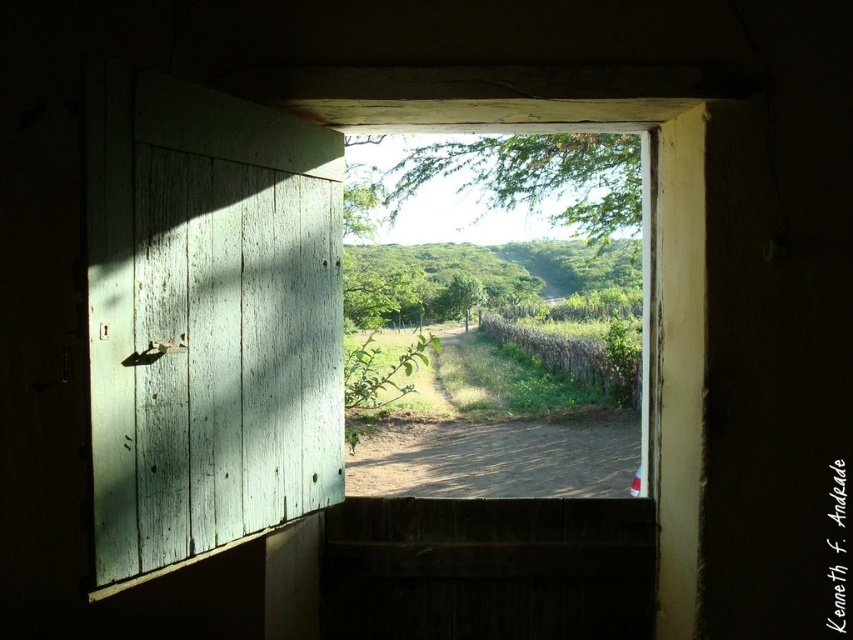
Is green wooden fence at center thinner than green leafy tree at center?

Correct, green wooden fence at center's width is less than green leafy tree at center's.

Measure the distance from green wooden fence at center to green leafy tree at center.

green wooden fence at center and green leafy tree at center are 2.82 meters apart.

What are the coordinates of `green wooden fence at center` in the screenshot? It's located at (537, 182).

Who is more distant from viewer, (x=195, y=515) or (x=418, y=312)?

The point (x=418, y=312) is behind.

Does green painted wood door at left have a greater height compared to green leafy tree at center?

Indeed, green painted wood door at left has a greater height compared to green leafy tree at center.

Locate an element on the screen. The image size is (853, 640). green painted wood door at left is located at coordinates (207, 320).

In the scene shown: Who is positioned more to the right, green painted wood door at left or green wooden fence at center?

green wooden fence at center is more to the right.

Is green painted wood door at left shorter than green wooden fence at center?

In fact, green painted wood door at left may be taller than green wooden fence at center.

Does point (160, 410) lie behind point (636, 136)?

No, it is not.

The image size is (853, 640). Identify the location of green painted wood door at left. (207, 320).